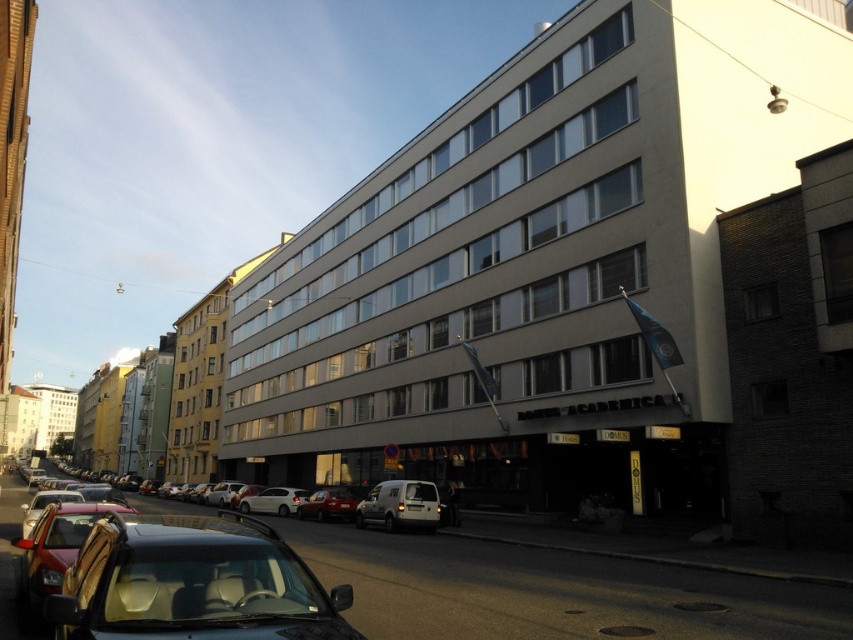
Is matte silver hatchback at center to the right of white matte car at center from the viewer's perspective?

Yes, matte silver hatchback at center is to the right of white matte car at center.

Is matte silver hatchback at center thinner than white matte car at center?

Yes, matte silver hatchback at center is thinner than white matte car at center.

Identify the location of matte silver hatchback at center. The width and height of the screenshot is (853, 640). (328, 504).

Find the location of a particular element. Image resolution: width=853 pixels, height=640 pixels. matte silver hatchback at center is located at coordinates (328, 504).

Does white matte van at center appear on the right side of matte silver hatchback at center?

Correct, you'll find white matte van at center to the right of matte silver hatchback at center.

Which is in front, point (398, 502) or point (328, 508)?

Point (398, 502)

Find the location of `white matte van at center`. white matte van at center is located at coordinates (399, 506).

Which is behind, point (56, 584) or point (410, 481)?

Positioned behind is point (410, 481).

Who is more forward, (51, 522) or (428, 499)?

Point (51, 522) is more forward.

Between point (45, 513) and point (403, 480), which one is positioned behind?

Positioned behind is point (403, 480).

Locate an element on the screen. shiny red car at lower left is located at coordinates (53, 552).